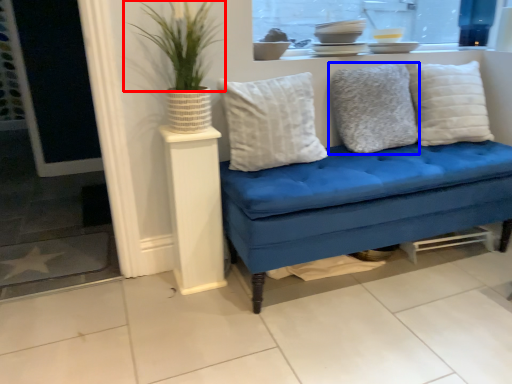
Question: Among these objects, which one is farthest to the camera, plant (highlighted by a red box) or pillow (highlighted by a blue box)?

Choices:
 (A) plant
 (B) pillow

Answer: (B)